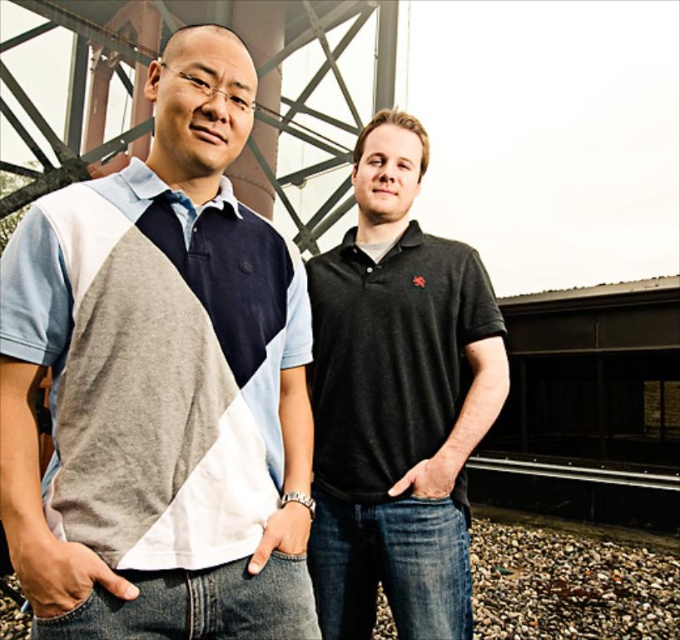
You are standing in front of the modern architectural structure and want to determine which of the two points, point (97, 372) or point (381, 342), is nearer to your current position. Based on the image, which point is closer to you?

Point (97, 372) is closer to the camera than point (381, 342), so it is the nearer point to your current position.